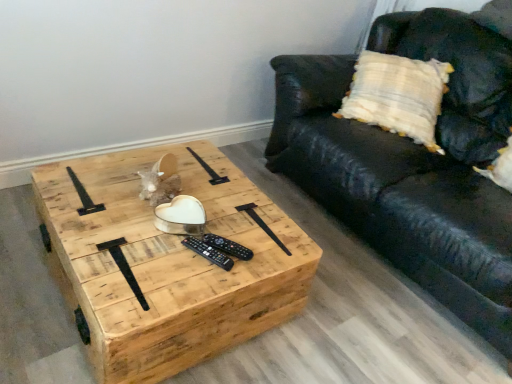
Where is `blank space situated above natural wood coffee table at center (from a real-world perspective)`? blank space situated above natural wood coffee table at center (from a real-world perspective) is located at coordinates (172, 207).